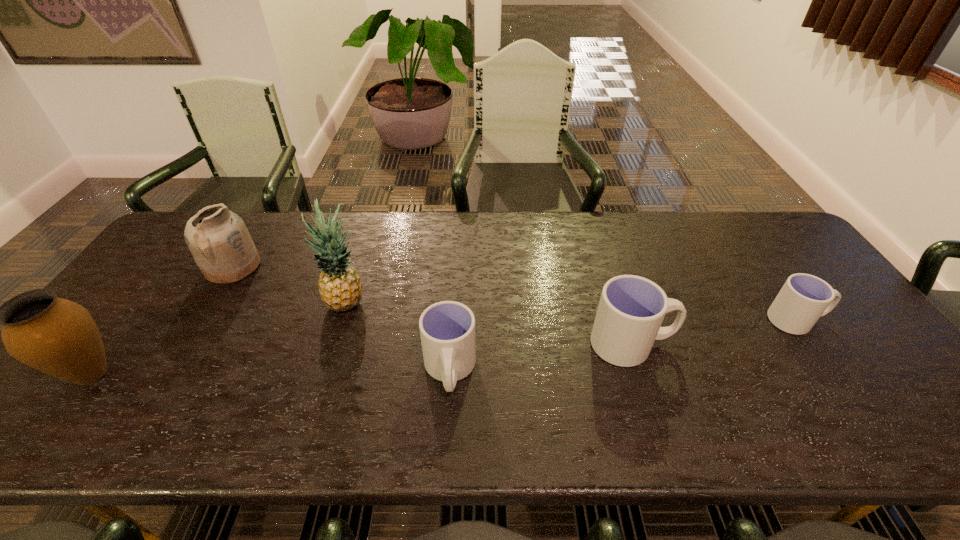
Locate an element on the screen. the leftmost cup is located at coordinates (447, 328).

Locate an element on the screen. the second tallest cup is located at coordinates (447, 328).

The width and height of the screenshot is (960, 540). I want to click on the second cup from right to left, so click(631, 309).

Locate an element on the screen. the shortest cup is located at coordinates (804, 298).

Identify the location of the rightmost object. (804, 298).

Image resolution: width=960 pixels, height=540 pixels. Find the location of `the farthest object`. the farthest object is located at coordinates click(218, 239).

The height and width of the screenshot is (540, 960). Find the location of `the fifth object from right to left`. the fifth object from right to left is located at coordinates (218, 239).

Identify the location of the third object from left to right. (340, 286).

Where is `the tallest object`? the tallest object is located at coordinates (340, 286).

At what (x,y) coordinates should I click in order to perform the action: click on urn. Please return your answer as a coordinate pair (x, y). This screenshot has width=960, height=540. Looking at the image, I should click on (59, 337).